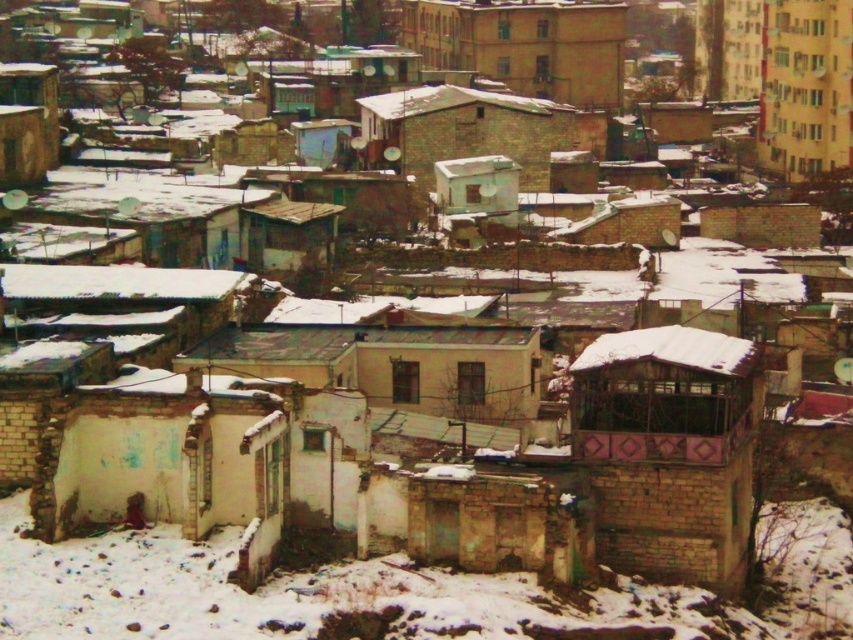
Question: Which of these objects is positioned closest to the brown brick hut at center-right?

Choices:
 (A) beige concrete building at upper center
 (B) brown brick hut at center

Answer: (B)

Question: Does brown brick hut at center-right have a greater width compared to beige concrete building at upper center?

Choices:
 (A) yes
 (B) no

Answer: (B)

Question: Which object is the farthest from the brown brick hut at center?

Choices:
 (A) brown brick hut at center-right
 (B) beige concrete building at upper center

Answer: (A)

Question: Can you confirm if beige concrete building at upper center is wider than brown brick hut at center?

Choices:
 (A) no
 (B) yes

Answer: (B)

Question: Among these objects, which one is nearest to the camera?

Choices:
 (A) brown brick hut at center
 (B) beige concrete building at upper center
 (C) brown brick hut at center-right

Answer: (C)

Question: Where is beige concrete building at upper center located in relation to brown brick hut at center in the image?

Choices:
 (A) left
 (B) right

Answer: (B)